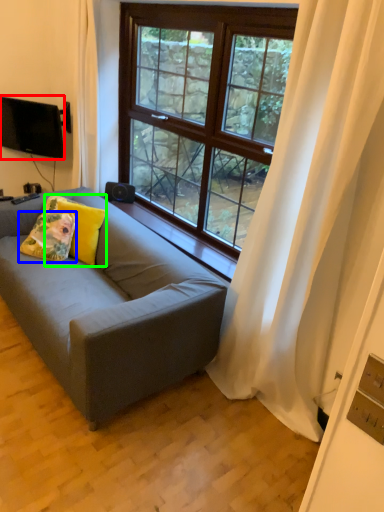
Question: Based on their relative distances, which object is nearer to television (highlighted by a red box)? Choose from pillow (highlighted by a blue box) and pillow (highlighted by a green box).

Choices:
 (A) pillow
 (B) pillow

Answer: (B)